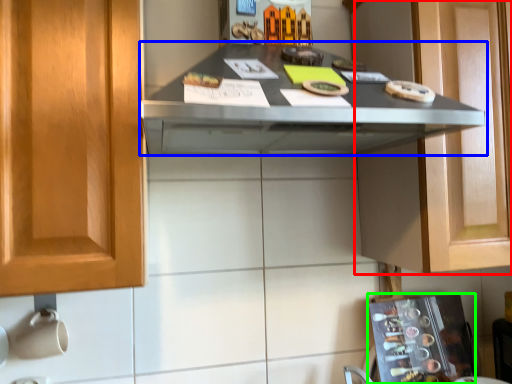
Question: Estimate the real-world distances between objects in this image. Which object is closer to cabinetry (highlighted by a red box), countertop (highlighted by a blue box) or appliance (highlighted by a green box)?

Choices:
 (A) countertop
 (B) appliance

Answer: (A)